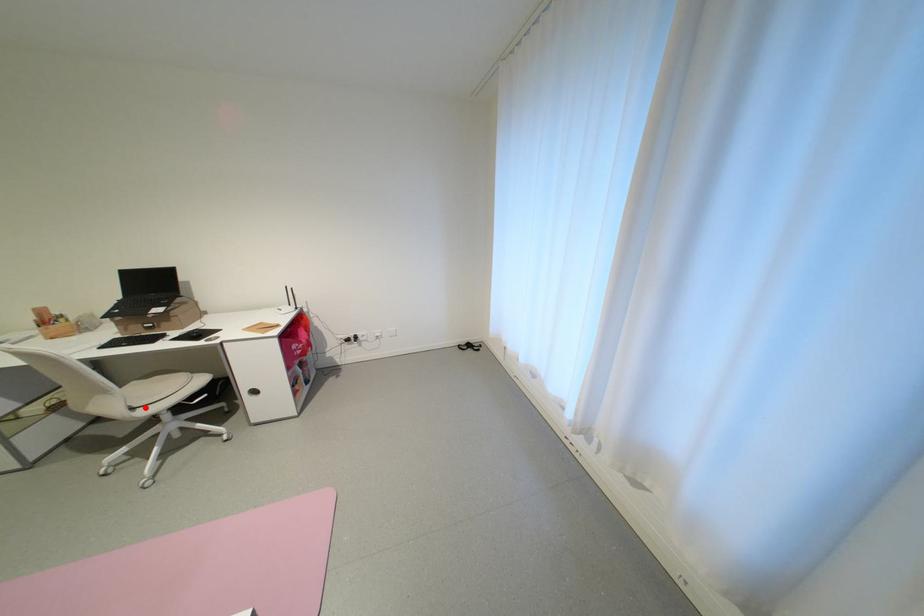
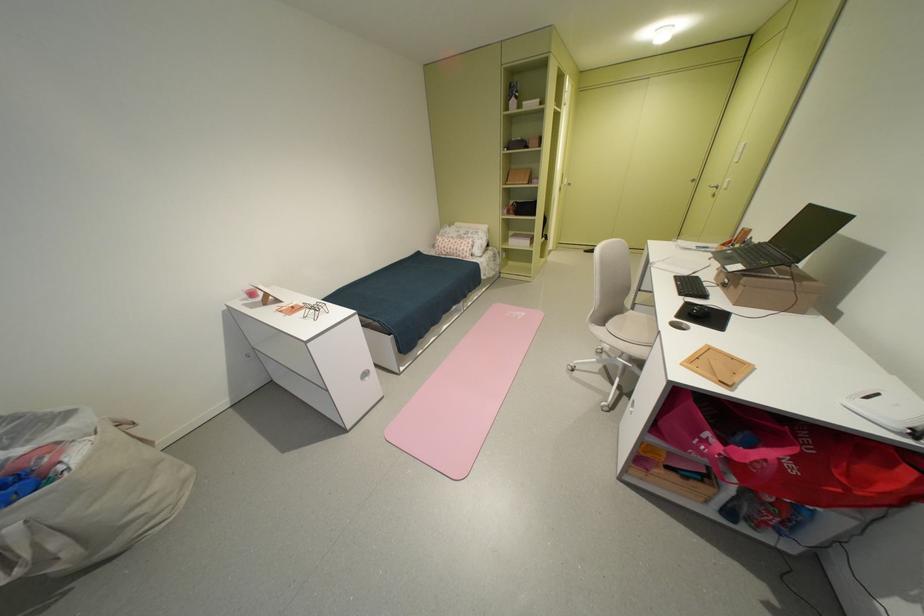
Locate, in the second image, the point that corresponds to the highlighted location in the first image.

(615, 326)